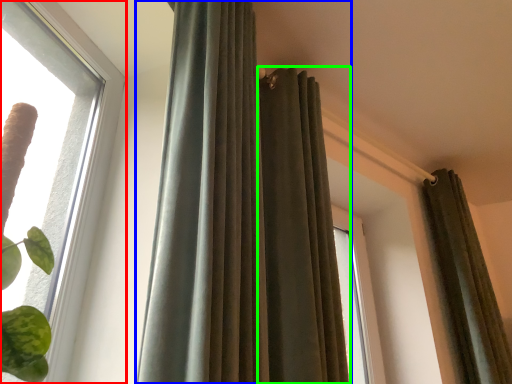
Question: Which object is positioned closest to window (highlighted by a red box)? Select from curtain (highlighted by a blue box) and curtain (highlighted by a green box).

Choices:
 (A) curtain
 (B) curtain

Answer: (A)